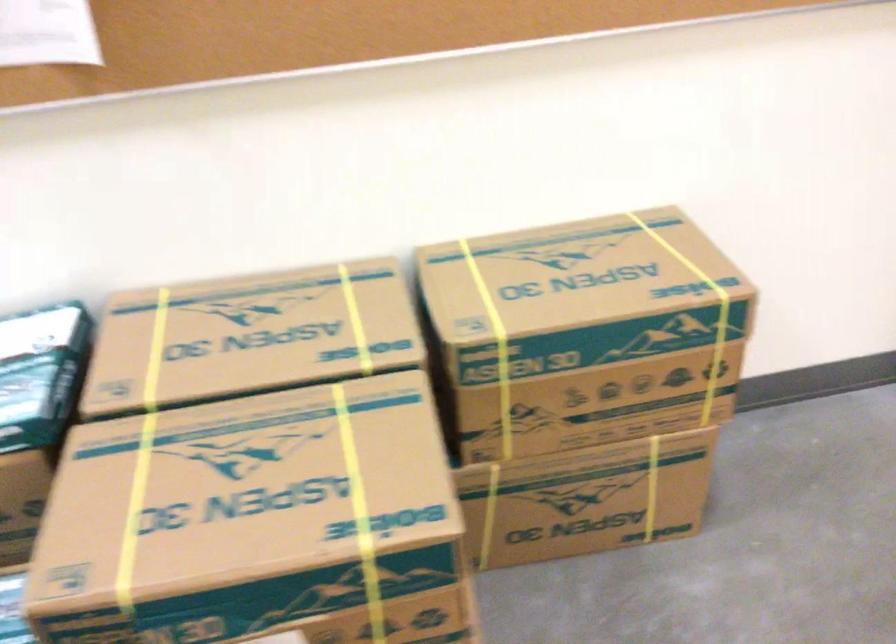
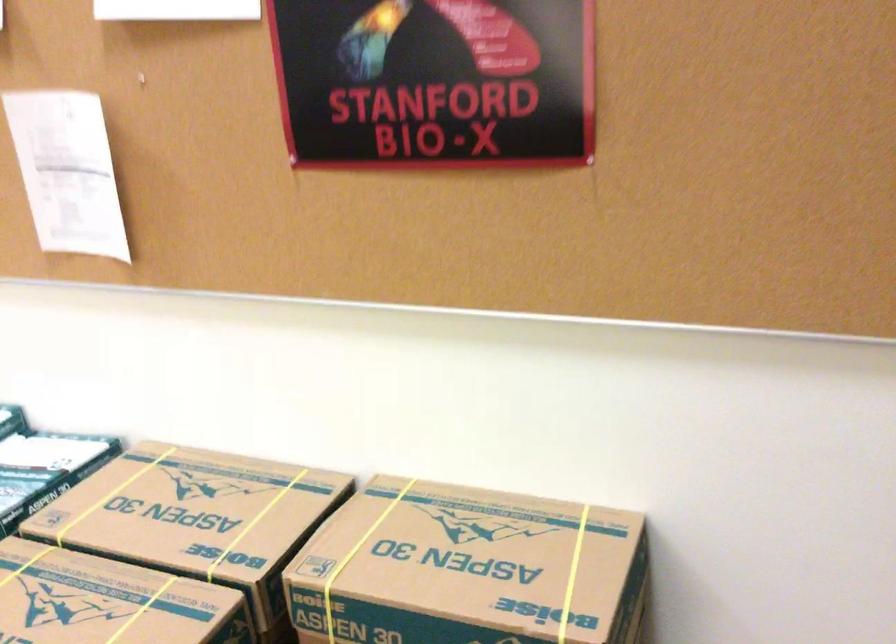
Find the pixel in the second image that matches pixel 297 430 in the first image.

(108, 601)